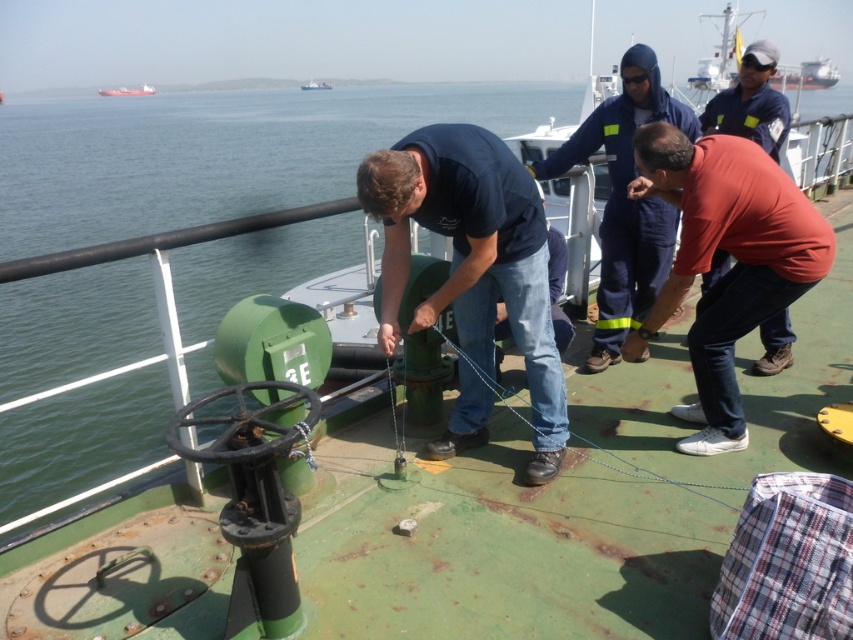
Question: Which point is farther to the camera?

Choices:
 (A) (606, 200)
 (B) (822, 81)

Answer: (B)

Question: Does matte green pipe at center have a greater width compared to red matte cargo ship at upper left?

Choices:
 (A) no
 (B) yes

Answer: (A)

Question: Can you confirm if matte green pipe at center is positioned above matte red shirt at center?

Choices:
 (A) no
 (B) yes

Answer: (A)

Question: Which object is closer to the camera taking this photo?

Choices:
 (A) matte red shirt at center
 (B) brushed metal boat at upper center
 (C) matte green pipe at center

Answer: (C)

Question: Does green rubber hose at center have a smaller size compared to matte green pipe at center?

Choices:
 (A) yes
 (B) no

Answer: (B)

Question: Which point is farther from the camera taking this photo?

Choices:
 (A) (126, 96)
 (B) (735, 51)
 (C) (575, 291)
 (D) (387, 205)

Answer: (A)